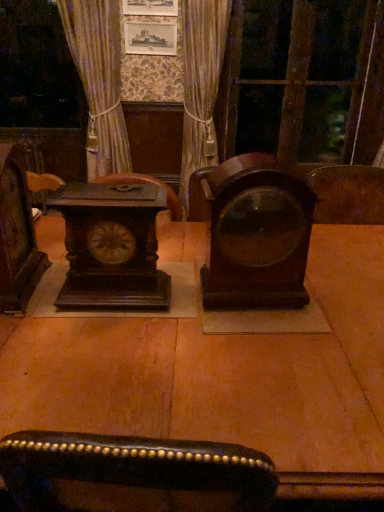
What are the coordinates of `vacant space to the right of dark brown wood clock at left, the 2th alarm clock in the right-to-left sequence` in the screenshot? It's located at (192, 304).